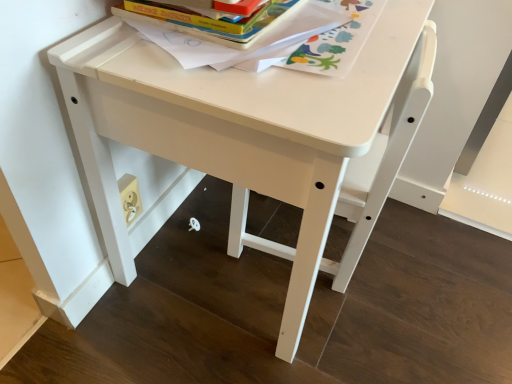
Locate an element on the screen. The image size is (512, 384). unoccupied region to the right of white plastic chair at center is located at coordinates (412, 264).